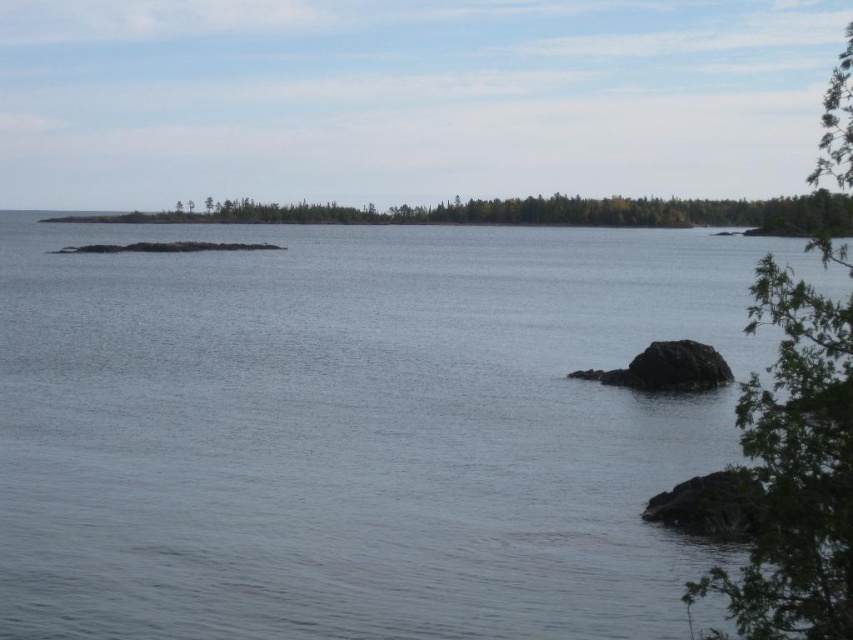
You are an environmental scientist assessing the scene. You need to determine which area covers more space in the image between the clear water at center and the green leafy tree at right. Based on the description, which one occupies a larger area?

The green leafy tree at right occupies more space than the clear water at center according to the description.

You are a boat captain navigating a narrow channel between the clear water at center and the green matte forest at center. The channel is 25 meters wide. Can your boat safely pass through the channel?

The clear water at center and green matte forest at center are 25.60 meters apart, so the channel is wide enough for the boat to pass safely since it is slightly wider than the required 25 meters.